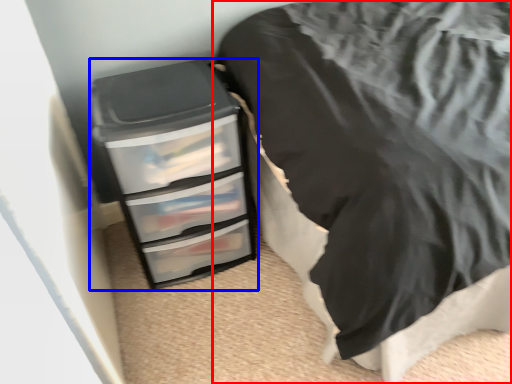
Question: Which object appears farthest to the camera in this image, furniture (highlighted by a red box) or chest of drawers (highlighted by a blue box)?

Choices:
 (A) furniture
 (B) chest of drawers

Answer: (B)